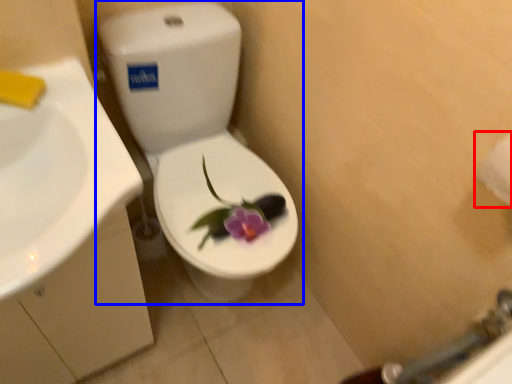
Question: Among these objects, which one is nearest to the camera, toilet paper (highlighted by a red box) or toilet (highlighted by a blue box)?

Choices:
 (A) toilet paper
 (B) toilet

Answer: (A)